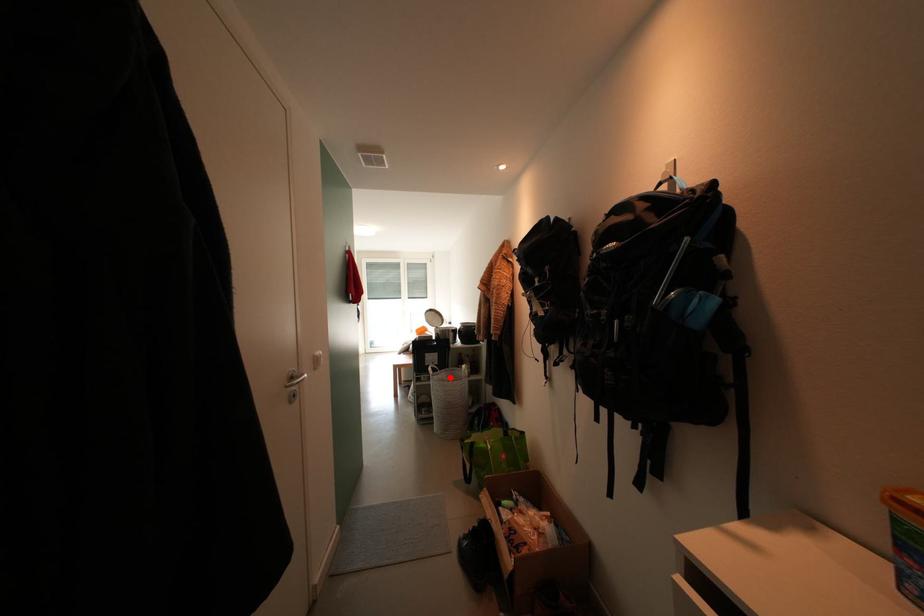
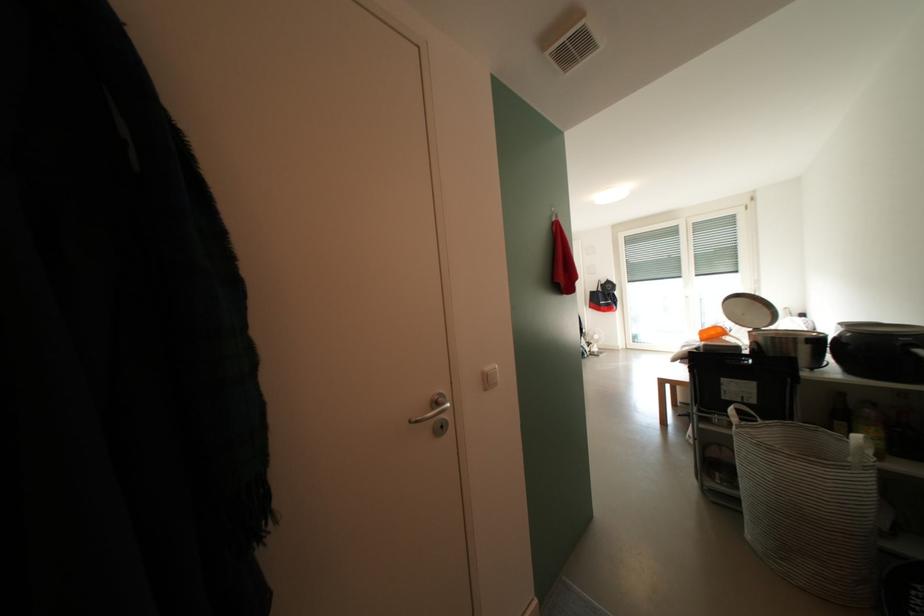
Where in the second image is the point corresponding to the highlighted location from the first image?

(779, 435)